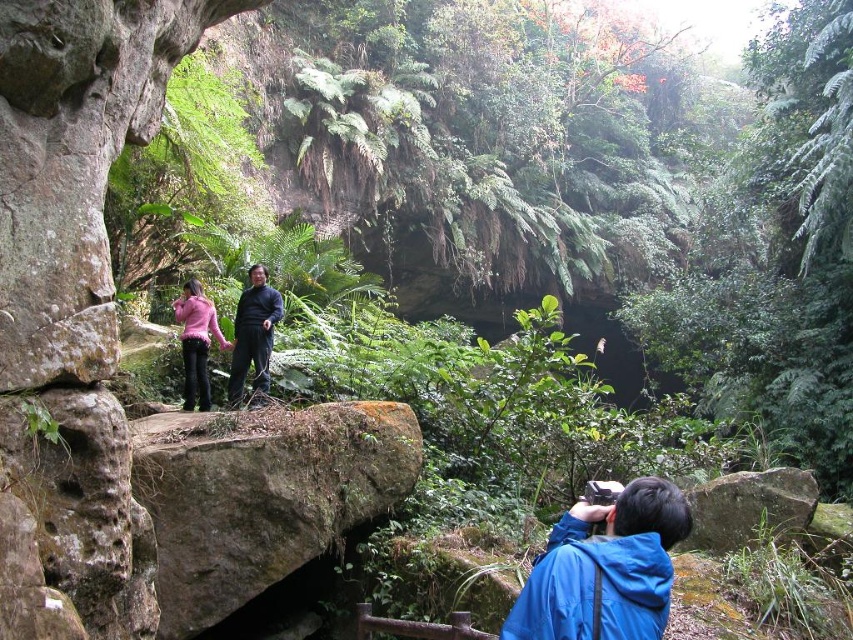
Is smooth gray rock at lower right to the left of pink fleece jacket at center from the viewer's perspective?

In fact, smooth gray rock at lower right is to the right of pink fleece jacket at center.

Who is taller, smooth gray rock at lower right or pink fleece jacket at center?

pink fleece jacket at center

Is point (811, 481) less distant than point (207, 337)?

That is True.

At what (x,y) coordinates should I click in order to perform the action: click on smooth gray rock at lower right. Please return your answer as a coordinate pair (x, y). Looking at the image, I should click on (749, 508).

Where is `brown rough rock at center`? This screenshot has width=853, height=640. brown rough rock at center is located at coordinates (260, 493).

Does point (335, 499) come farther from viewer compared to point (271, 337)?

No, (335, 499) is closer to viewer.

Who is more distant from viewer, (206, 422) or (260, 333)?

Positioned behind is point (260, 333).

At what (x,y) coordinates should I click in order to perform the action: click on brown rough rock at center. Please return your answer as a coordinate pair (x, y). This screenshot has width=853, height=640. Looking at the image, I should click on (260, 493).

Does brown rough rock at center appear on the right side of blue fabric jacket at lower right?

No, brown rough rock at center is not to the right of blue fabric jacket at lower right.

Is point (194, 608) positioned behind point (595, 573)?

Yes, it is behind point (595, 573).

Locate an element on the screen. Image resolution: width=853 pixels, height=640 pixels. brown rough rock at center is located at coordinates (260, 493).